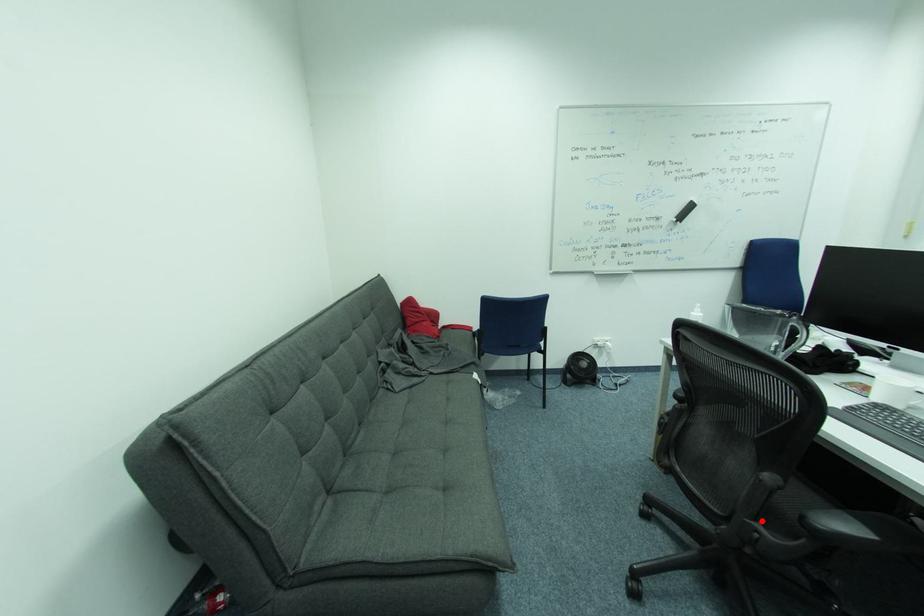
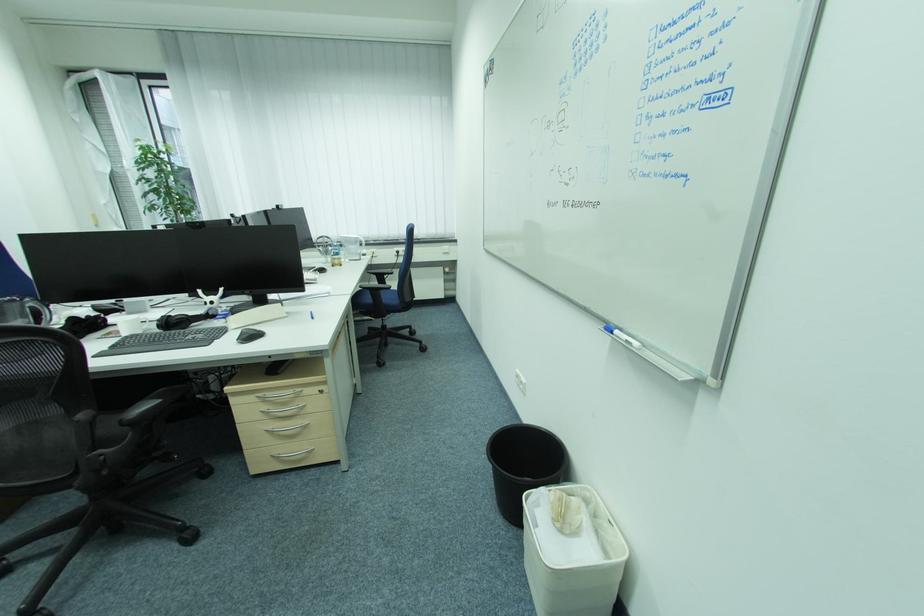
Question: A red point is marked in image1. In image2, is the corresponding 3D point closer to the camera or farther? Reply with the corresponding letter.

Choices:
 (A) The corresponding 3D point is closer.
 (B) The corresponding 3D point is farther.

Answer: (A)